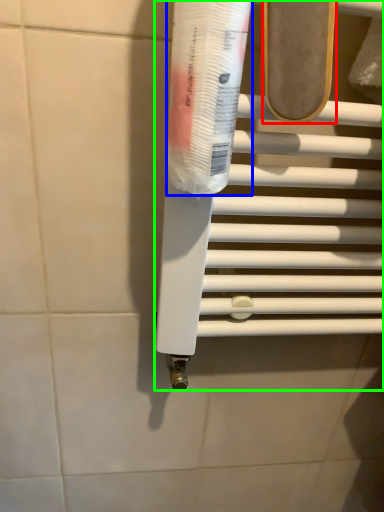
Question: Based on their relative distances, which object is nearer to footwear (highlighted by a red box)? Choose from toothpaste (highlighted by a blue box) and towel bar (highlighted by a green box).

Choices:
 (A) toothpaste
 (B) towel bar

Answer: (A)